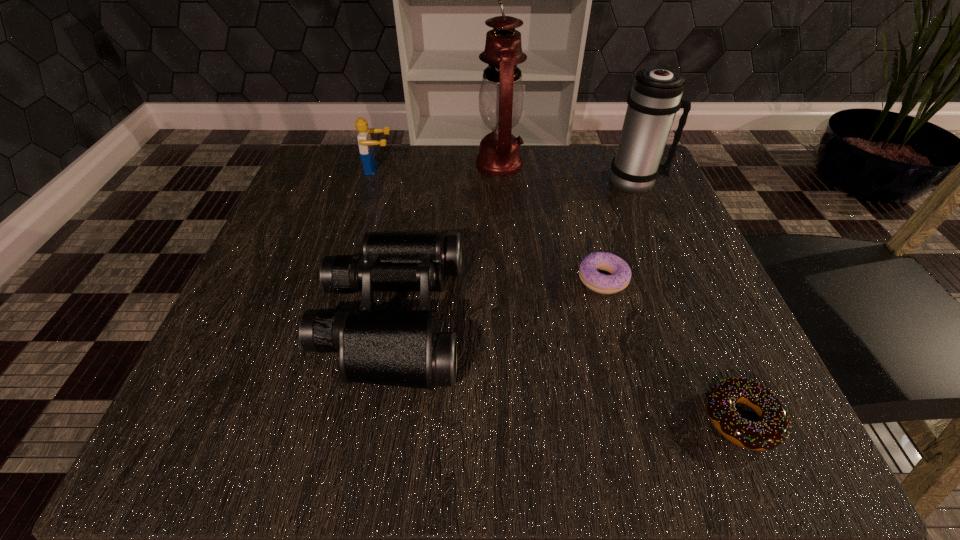
Identify the location of vacant space situated 0.320m on the front-facing side of the binoculars. The image size is (960, 540). (668, 317).

Identify the location of vacant point located 0.120m on the front of the fourth object from left to right. The height and width of the screenshot is (540, 960). (625, 362).

The height and width of the screenshot is (540, 960). I want to click on vacant space situated on the back of the nearer doughnut, so click(x=682, y=283).

The width and height of the screenshot is (960, 540). In order to click on oil lamp positioned at the far edge in this screenshot , I will do `click(501, 98)`.

I want to click on thermos bottle at the far edge, so click(655, 97).

I want to click on Lego located at the far edge, so click(366, 149).

At what (x,y) coordinates should I click in order to perform the action: click on binoculars located in the near edge section of the desktop. Please return your answer as a coordinate pair (x, y). Looking at the image, I should click on (395, 348).

I want to click on doughnut present at the near edge, so click(x=773, y=428).

Find the location of a particular element. Image resolution: width=960 pixels, height=540 pixels. Lego located at the left edge is located at coordinates pyautogui.click(x=366, y=149).

Where is `binoculars that is at the left edge`? Image resolution: width=960 pixels, height=540 pixels. binoculars that is at the left edge is located at coordinates (395, 348).